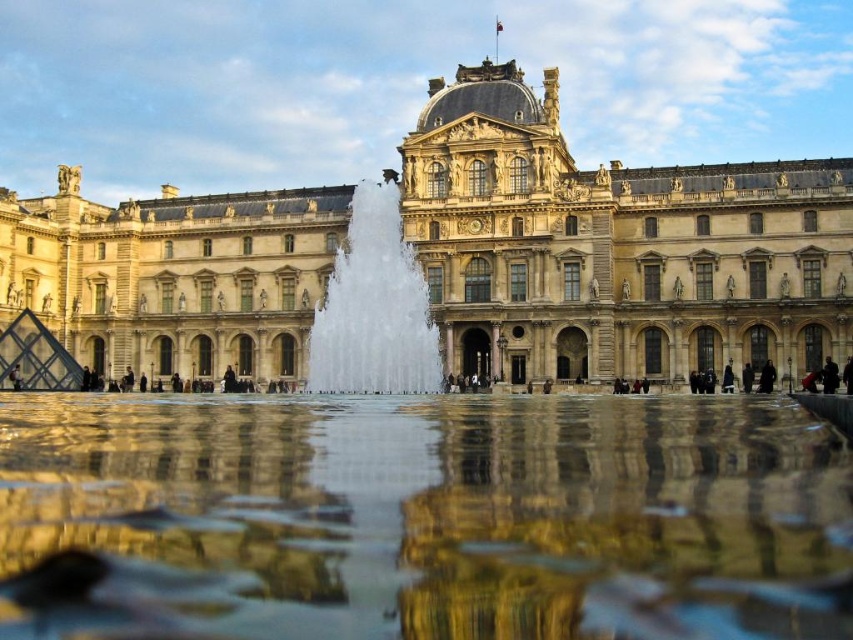
You are standing in front of the grand building and want to take a photo of the clear glass water at center and the clear water fountain at center. Which object should you focus on first if you want to capture both in a single frame without moving the camera?

You should focus on the clear glass water at center first because it is positioned under the clear water fountain at center, so adjusting focus to the closer object will ensure both are in the frame.

You are standing in front of the grand building and want to walk from the point at coordinates point(x=317, y=616) to the point at coordinates point(x=412, y=346). Which direction should you move to reach your destination?

To move from point(x=317, y=616) to point(x=412, y=346), you should move backward since point(x=317, y=616) is in front of point(x=412, y=346).

You are standing in front of the grand building and want to take a photo that includes both the fountain and the dome. You notice two points marked in the image. Which point is closer to you, point at coordinate (0, 298) or point at coordinate (378, 262)?

Point at coordinate (0, 298) is closer to you than point at coordinate (378, 262) because it is further to the viewer.